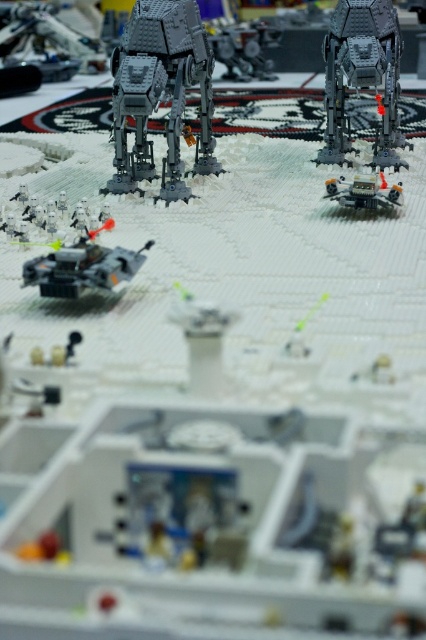
Question: Observing the image, what is the correct spatial positioning of metallic silver at-at walker at center in reference to metallic silver tank at center?

Choices:
 (A) left
 (B) right

Answer: (A)

Question: Which point is farther from the camera taking this photo?

Choices:
 (A) (324, 56)
 (B) (81, 212)

Answer: (A)

Question: Is metallic silver at-at walker at center below metallic silver tank at center?

Choices:
 (A) no
 (B) yes

Answer: (A)

Question: Which of the following is the closest to the observer?

Choices:
 (A) (350, 184)
 (B) (34, 234)
 (C) (242, 72)
 (D) (143, 104)

Answer: (B)

Question: Can you confirm if dark gray plastic walker at upper left is positioned to the left of metallic silver at-at walker at center?

Choices:
 (A) yes
 (B) no

Answer: (A)

Question: Which is farther from the metallic silver tank at center?

Choices:
 (A) matte black tank at lower left
 (B) dark gray metallic walker at upper right

Answer: (A)